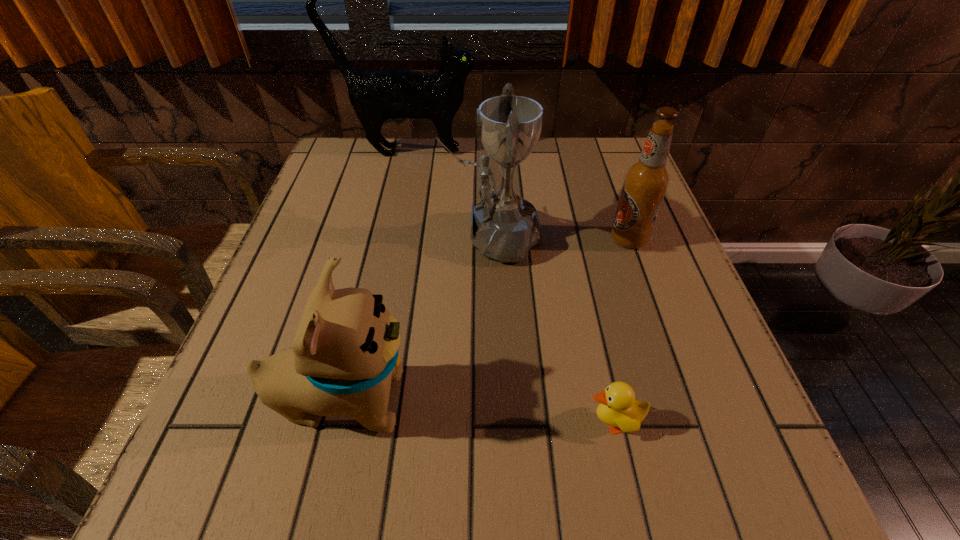
You are a GUI agent. You are given a task and a screenshot of the screen. Output one action in this format:
    pyautogui.click(x=<x>, y=<y>)
    Task: Click on the empty space that is in between the puppy and the tallest object
    The image size is (960, 540).
    Given the screenshot: What is the action you would take?
    pyautogui.click(x=375, y=275)

The height and width of the screenshot is (540, 960). I want to click on free area in between the shortest object and the beer bottle, so click(621, 330).

Identify the location of vacant space that's between the second object from right to left and the puppy. (478, 411).

The width and height of the screenshot is (960, 540). In order to click on empty space that is in between the farthest object and the duckling in this screenshot , I will do point(511,287).

You are a GUI agent. You are given a task and a screenshot of the screen. Output one action in this format:
    pyautogui.click(x=<x>, y=<y>)
    Task: Click on the free space between the cat and the award
    The image size is (960, 540).
    Given the screenshot: What is the action you would take?
    pyautogui.click(x=450, y=194)

This screenshot has width=960, height=540. In order to click on free space that is in between the award and the farthest object in this screenshot , I will do `click(450, 194)`.

Find the location of a particular element. The image size is (960, 540). unoccupied area between the shortest object and the rightmost object is located at coordinates (621, 330).

Locate an element on the screen. Image resolution: width=960 pixels, height=540 pixels. free point between the puppy and the beer bottle is located at coordinates (486, 319).

This screenshot has height=540, width=960. Find the location of `object that stands as the third closest to the rightmost object`. object that stands as the third closest to the rightmost object is located at coordinates (376, 95).

Point out which object is positioned as the third nearest to the award. Please provide its 2D coordinates. Your answer should be formatted as a tuple, i.e. [(x, y)], where the tuple contains the x and y coordinates of a point satisfying the conditions above.

[(344, 356)]